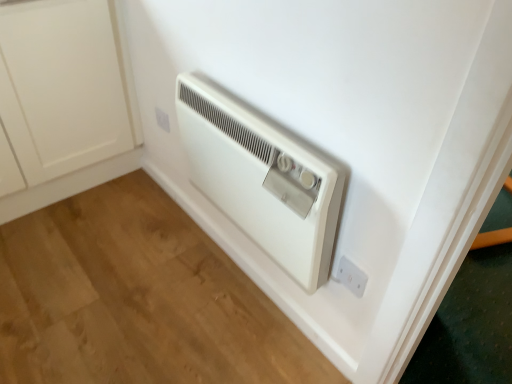
What do you see at coordinates (351, 276) in the screenshot? This screenshot has height=384, width=512. I see `white plastic electric outlet at lower right, the first electric outlet from the bottom` at bounding box center [351, 276].

Measure the distance between white matte cabinet at lower left and camera.

The depth of white matte cabinet at lower left is 1.30 meters.

You are a GUI agent. You are given a task and a screenshot of the screen. Output one action in this format:
    pyautogui.click(x=<x>, y=<y>)
    Task: Click on the white plastic heater at center
    The height and width of the screenshot is (384, 512).
    Given the screenshot: What is the action you would take?
    pyautogui.click(x=262, y=177)

Does white matte cabinet at lower left turn towards white plastic heater at center?

Yes, white matte cabinet at lower left faces towards white plastic heater at center.

Which object is thinner, white matte cabinet at lower left or white plastic heater at center?

white plastic heater at center is thinner.

Is white matte cabinet at lower left in front of or behind white plastic heater at center in the image?

Visually, white matte cabinet at lower left is located behind white plastic heater at center.

Is white matte cabinet at lower left surrounding white plastic heater at center?

No, white plastic heater at center is not inside white matte cabinet at lower left.

Could you tell me if white matte cabinet at lower left is turned towards white plastic electric outlet at lower center, acting as the 1th electric outlet starting from the left?

Yes, white matte cabinet at lower left is aimed at white plastic electric outlet at lower center, acting as the 1th electric outlet starting from the left.

Which is farther from the camera, (x=47, y=100) or (x=159, y=118)?

The point (x=159, y=118) is farther.

Looking at this image, considering the relative positions of white matte cabinet at lower left and white plastic electric outlet at lower center, which is the 2th electric outlet from front to back, in the image provided, is white matte cabinet at lower left to the left or to the right of white plastic electric outlet at lower center, which is the 2th electric outlet from front to back,?

From the image, it's evident that white matte cabinet at lower left is to the left of white plastic electric outlet at lower center, which is the 2th electric outlet from front to back.

You are a GUI agent. You are given a task and a screenshot of the screen. Output one action in this format:
    pyautogui.click(x=<x>, y=<y>)
    Task: Click on the cabinetry that is above the white plastic electric outlet at lower center, arranged as the 1th electric outlet when viewed from the back (from a real-world perspective)
    Image resolution: width=512 pixels, height=384 pixels.
    Given the screenshot: What is the action you would take?
    pyautogui.click(x=66, y=99)

Which point is more forward, (x=356, y=289) or (x=56, y=110)?

Point (x=356, y=289)

How different are the orientations of white plastic electric outlet at lower right, which is the 2th electric outlet in top-to-bottom order, and white matte cabinet at lower left in degrees?

They differ by 94.4 degrees in their facing directions.

From the image's perspective, relative to white matte cabinet at lower left, is white plastic electric outlet at lower right, positioned as the 2th electric outlet in back-to-front order, above or below?

Based on their image positions, white plastic electric outlet at lower right, positioned as the 2th electric outlet in back-to-front order, is located beneath white matte cabinet at lower left.

Is white plastic electric outlet at lower right, the first electric outlet from the front, smaller than white matte cabinet at lower left?

Yes.

Which of these two, white plastic electric outlet at lower right, which is the 2th electric outlet in top-to-bottom order, or white plastic heater at center, is bigger?

Bigger between the two is white plastic heater at center.

Is white plastic electric outlet at lower right, the first electric outlet from the front, next to white plastic heater at center?

No, white plastic electric outlet at lower right, the first electric outlet from the front, is not beside white plastic heater at center.

Is point (354, 273) closer to viewer compared to point (274, 249)?

Yes, it is.

The height and width of the screenshot is (384, 512). I want to click on home appliance that appears above the white plastic electric outlet at lower right, which is the second electric outlet in left-to-right order (from the image's perspective), so click(262, 177).

From a real-world perspective, is white plastic electric outlet at lower right, positioned as the 2th electric outlet in back-to-front order, located higher than white plastic electric outlet at lower center, which is the 2th electric outlet from front to back?

No.

Which is farther, (358, 286) or (157, 118)?

The point (157, 118) is farther from the camera.

Is white plastic electric outlet at lower right, positioned as the 2th electric outlet in back-to-front order, in front of white plastic electric outlet at lower center, acting as the 1th electric outlet starting from the left?

Yes.

Based on the photo, is white plastic electric outlet at lower right, the first electric outlet from the bottom, turned away from white plastic electric outlet at lower center, arranged as the second electric outlet when viewed from the right?

No.

Is white plastic heater at center taller than white plastic electric outlet at lower right, which is the 2th electric outlet in top-to-bottom order?

Correct, white plastic heater at center is much taller as white plastic electric outlet at lower right, which is the 2th electric outlet in top-to-bottom order.

Does white plastic heater at center have a larger size compared to white plastic electric outlet at lower right, which is the second electric outlet in left-to-right order?

Indeed, white plastic heater at center has a larger size compared to white plastic electric outlet at lower right, which is the second electric outlet in left-to-right order.

Is point (204, 107) farther from camera compared to point (358, 285)?

Yes, point (204, 107) is behind point (358, 285).

Between white plastic heater at center and white plastic electric outlet at lower right, positioned as the first electric outlet in right-to-left order, which one appears on the left side from the viewer's perspective?

From the viewer's perspective, white plastic heater at center appears more on the left side.

In order to click on cabinetry on the left of white plastic electric outlet at lower center, arranged as the 1th electric outlet when viewed from the back in this screenshot , I will do `click(66, 99)`.

In terms of size, does white plastic electric outlet at lower center, which is the 2th electric outlet from front to back, appear bigger or smaller than white matte cabinet at lower left?

white plastic electric outlet at lower center, which is the 2th electric outlet from front to back, is smaller than white matte cabinet at lower left.

Is white plastic electric outlet at lower center, acting as the 1th electric outlet starting from the left, wider or thinner than white matte cabinet at lower left?

white plastic electric outlet at lower center, acting as the 1th electric outlet starting from the left, is thinner than white matte cabinet at lower left.

Is white plastic electric outlet at lower center, arranged as the second electric outlet when viewed from the right, completely or partially outside of white matte cabinet at lower left?

white plastic electric outlet at lower center, arranged as the second electric outlet when viewed from the right, is positioned outside white matte cabinet at lower left.

Locate an element on the screen. The width and height of the screenshot is (512, 384). cabinetry on the left of white plastic heater at center is located at coordinates (66, 99).

This screenshot has width=512, height=384. In order to click on electric outlet behind the white matte cabinet at lower left in this screenshot , I will do `click(162, 119)`.

When comparing their distances from white plastic electric outlet at lower center, arranged as the 1th electric outlet when viewed from the back, does white matte cabinet at lower left or white plastic electric outlet at lower right, which is the second electric outlet in left-to-right order, seem closer?

Among the two, white matte cabinet at lower left is located nearer to white plastic electric outlet at lower center, arranged as the 1th electric outlet when viewed from the back.

When comparing their distances from white matte cabinet at lower left, does white plastic electric outlet at lower right, positioned as the first electric outlet in right-to-left order, or white plastic heater at center seem further?

white plastic electric outlet at lower right, positioned as the first electric outlet in right-to-left order, lies further to white matte cabinet at lower left than the other object.

Considering their positions, is white matte cabinet at lower left positioned further to white plastic electric outlet at lower center, which is the 2th electric outlet from front to back, than white plastic heater at center?

white plastic heater at center is further to white plastic electric outlet at lower center, which is the 2th electric outlet from front to back.

Considering their positions, is white plastic electric outlet at lower right, the first electric outlet from the front, positioned further to white plastic heater at center than white plastic electric outlet at lower center, which ranks as the second electric outlet in bottom-to-top order?

white plastic electric outlet at lower center, which ranks as the second electric outlet in bottom-to-top order, lies further to white plastic heater at center than the other object.

Based on their spatial positions, is white plastic electric outlet at lower center, which is the 2th electric outlet from front to back, or white plastic heater at center closer to white matte cabinet at lower left?

Answer: white plastic electric outlet at lower center, which is the 2th electric outlet from front to back, is positioned closer to the anchor white matte cabinet at lower left.

From the image, which object appears to be farther from white plastic heater at center, white plastic electric outlet at lower center, arranged as the 1th electric outlet when viewed from the back, or white matte cabinet at lower left?

white matte cabinet at lower left is positioned further to the anchor white plastic heater at center.

When comparing their distances from white plastic electric outlet at lower center, arranged as the 1th electric outlet when viewed from the back, does white plastic heater at center or white matte cabinet at lower left seem further?

white plastic heater at center is positioned further to the anchor white plastic electric outlet at lower center, arranged as the 1th electric outlet when viewed from the back.

When comparing their distances from white plastic electric outlet at lower center, arranged as the 1th electric outlet when viewed from the back, does white plastic electric outlet at lower right, the first electric outlet from the bottom, or white matte cabinet at lower left seem closer?

white matte cabinet at lower left.

Locate an element on the screen. This screenshot has width=512, height=384. electric outlet situated between white matte cabinet at lower left and white plastic heater at center from left to right is located at coordinates (162, 119).

Locate an element on the screen. electric outlet positioned between white plastic heater at center and white plastic electric outlet at lower center, arranged as the 1th electric outlet when viewed from the back, from near to far is located at coordinates (351, 276).

Find the location of a particular element. Image resolution: width=512 pixels, height=384 pixels. electric outlet between white matte cabinet at lower left and white plastic electric outlet at lower right, which is the 2th electric outlet in top-to-bottom order, in the horizontal direction is located at coordinates (162, 119).

Identify the location of home appliance situated between white matte cabinet at lower left and white plastic electric outlet at lower right, positioned as the 2th electric outlet in back-to-front order, from left to right. This screenshot has height=384, width=512. (262, 177).